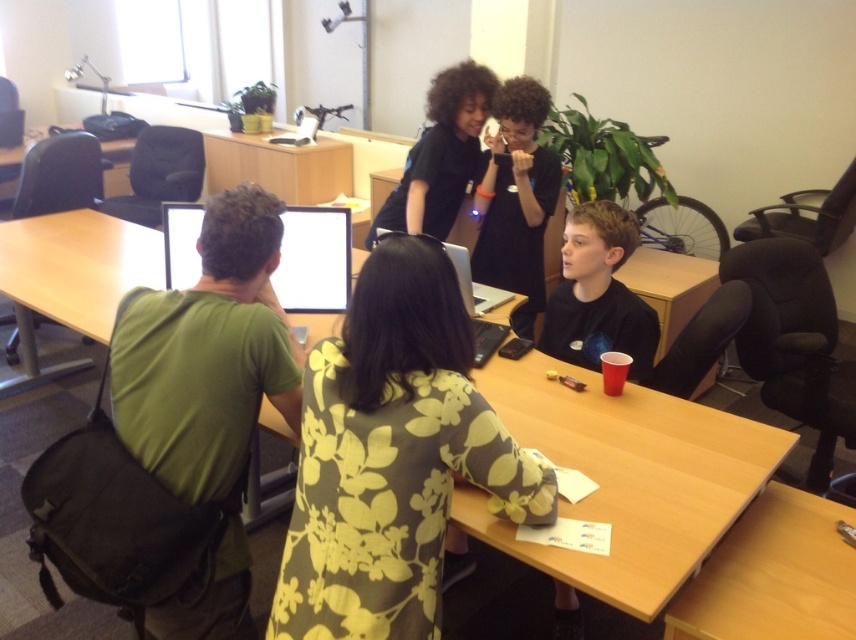
Does wooden table at center appear under silver metallic laptop at center?

No, wooden table at center is not below silver metallic laptop at center.

Is wooden table at center to the right of silver metallic laptop at center from the viewer's perspective?

Incorrect, wooden table at center is not on the right side of silver metallic laptop at center.

Does point (551, 381) lie in front of point (467, 310)?

No, it is behind (467, 310).

Locate an element on the screen. The image size is (856, 640). wooden table at center is located at coordinates (626, 477).

Is black matte phone at center behind bright white glossy monitor at upper center?

Yes, it is.

Is point (476, 268) in front of point (317, 269)?

No.

Between point (522, 332) and point (349, 230), which one is positioned behind?

Positioned behind is point (522, 332).

You are a GUI agent. You are given a task and a screenshot of the screen. Output one action in this format:
    pyautogui.click(x=<x>, y=<y>)
    Task: Click on the black matte phone at center
    
    Given the screenshot: What is the action you would take?
    pyautogui.click(x=516, y=198)

Who is shorter, silver metallic laptop at center or matte black laptop at center?

silver metallic laptop at center

Who is positioned more to the right, silver metallic laptop at center or matte black laptop at center?

From the viewer's perspective, silver metallic laptop at center appears more on the right side.

Does point (465, 294) come behind point (310, 129)?

No, it is not.

At what (x,y) coordinates should I click in order to perform the action: click on silver metallic laptop at center. Please return your answer as a coordinate pair (x, y). Image resolution: width=856 pixels, height=640 pixels. Looking at the image, I should click on (473, 284).